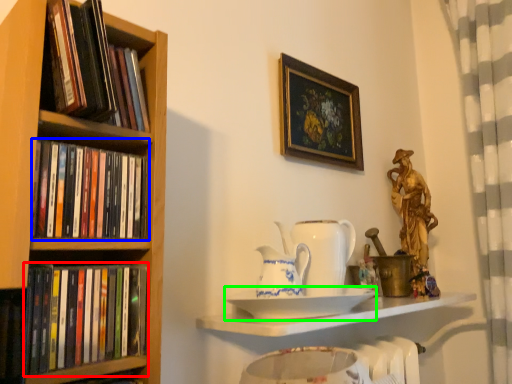
Question: Considering the real-world distances, which object is farthest from book (highlighted by a red box)? book (highlighted by a blue box) or plate (highlighted by a green box)?

Choices:
 (A) book
 (B) plate

Answer: (B)